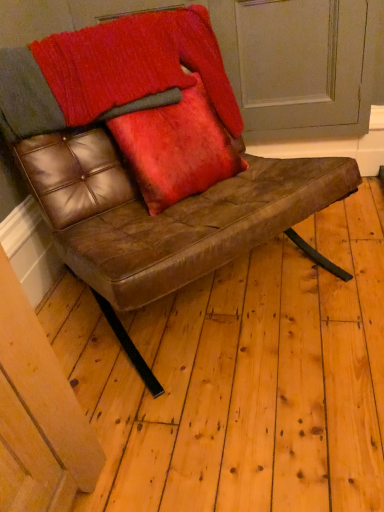
What do you see at coordinates (177, 148) in the screenshot? I see `velvet red cushion at center` at bounding box center [177, 148].

I want to click on velvet red cushion at center, so click(x=177, y=148).

What are the coordinates of `brown leather chair at center` in the screenshot? It's located at (151, 163).

The height and width of the screenshot is (512, 384). What do you see at coordinates (151, 163) in the screenshot?
I see `brown leather chair at center` at bounding box center [151, 163].

Where is `velvet red cushion at center`? The width and height of the screenshot is (384, 512). velvet red cushion at center is located at coordinates click(177, 148).

Which object is positioned more to the right, brown leather chair at center or velvet red cushion at center?

Positioned to the right is velvet red cushion at center.

Relative to velvet red cushion at center, is brown leather chair at center in front or behind?

Visually, brown leather chair at center is located in front of velvet red cushion at center.

Is point (36, 181) closer or farther from the camera than point (166, 142)?

Point (36, 181) is closer to the camera than point (166, 142).

From the image's perspective, which one is positioned higher, brown leather chair at center or velvet red cushion at center?

velvet red cushion at center appears higher in the image.

From a real-world perspective, is brown leather chair at center located beneath velvet red cushion at center?

Indeed, from a real-world perspective, brown leather chair at center is positioned beneath velvet red cushion at center.

From the picture: Is brown leather chair at center wider than velvet red cushion at center?

Correct, the width of brown leather chair at center exceeds that of velvet red cushion at center.

From their relative heights in the image, would you say brown leather chair at center is taller or shorter than velvet red cushion at center?

Considering their sizes, brown leather chair at center has more height than velvet red cushion at center.

Does brown leather chair at center have a smaller size compared to velvet red cushion at center?

No, brown leather chair at center is not smaller than velvet red cushion at center.

Is brown leather chair at center inside the boundaries of velvet red cushion at center, or outside?

The correct answer is: outside.

Is there a large distance between brown leather chair at center and velvet red cushion at center?

No, brown leather chair at center is not far from velvet red cushion at center.

Is brown leather chair at center facing away from velvet red cushion at center?

Yes.

What's the angular difference between brown leather chair at center and velvet red cushion at center's facing directions?

There is a 0.00288-degree angle between the facing directions of brown leather chair at center and velvet red cushion at center.

This screenshot has width=384, height=512. I want to click on chair that appears in front of the velvet red cushion at center, so click(x=151, y=163).

Can you confirm if velvet red cushion at center is positioned to the left of brown leather chair at center?

Incorrect, velvet red cushion at center is not on the left side of brown leather chair at center.

Relative to brown leather chair at center, is velvet red cushion at center in front or behind?

velvet red cushion at center is behind brown leather chair at center.

Is point (170, 114) in front of point (50, 204)?

That is False.

From the image's perspective, would you say velvet red cushion at center is shown under brown leather chair at center?

No.

From a real-world perspective, who is located lower, velvet red cushion at center or brown leather chair at center?

From a 3D spatial view, brown leather chair at center is below.

From the picture: Between velvet red cushion at center and brown leather chair at center, which one has smaller width?

With smaller width is velvet red cushion at center.

Looking at this image, in terms of height, does velvet red cushion at center look taller or shorter compared to brown leather chair at center?

velvet red cushion at center is shorter than brown leather chair at center.

Is velvet red cushion at center bigger than brown leather chair at center?

No, velvet red cushion at center is not bigger than brown leather chair at center.

From the picture: Is velvet red cushion at center not within brown leather chair at center?

No, velvet red cushion at center is not entirely external to brown leather chair at center.

Based on the photo, is velvet red cushion at center next to brown leather chair at center?

No, velvet red cushion at center is not beside brown leather chair at center.

Is velvet red cushion at center oriented away from brown leather chair at center?

That's right, velvet red cushion at center is facing away from brown leather chair at center.

Can you tell me how much velvet red cushion at center and brown leather chair at center differ in facing direction?

The angular difference between velvet red cushion at center and brown leather chair at center is 0.00288 degrees.

How much distance is there between velvet red cushion at center and brown leather chair at center?

The distance of velvet red cushion at center from brown leather chair at center is 4.53 inches.

At what (x,y) coordinates should I click in order to perform the action: click on chair lying on the left of velvet red cushion at center. Please return your answer as a coordinate pair (x, y). The image size is (384, 512). Looking at the image, I should click on (151, 163).

Image resolution: width=384 pixels, height=512 pixels. Identify the location of throw pillow lying on the right of brown leather chair at center. (177, 148).

Locate an element on the screen. The image size is (384, 512). throw pillow above the brown leather chair at center (from a real-world perspective) is located at coordinates (177, 148).